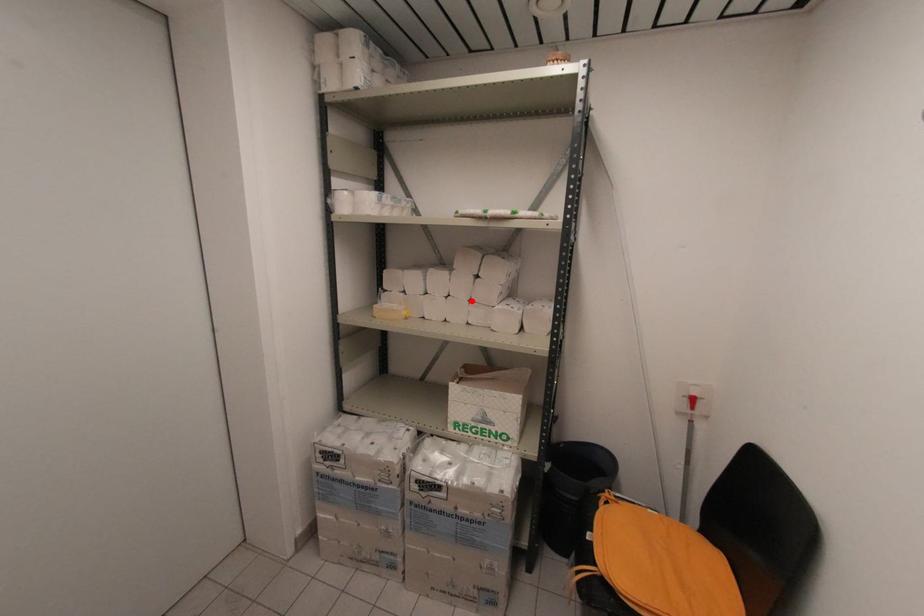
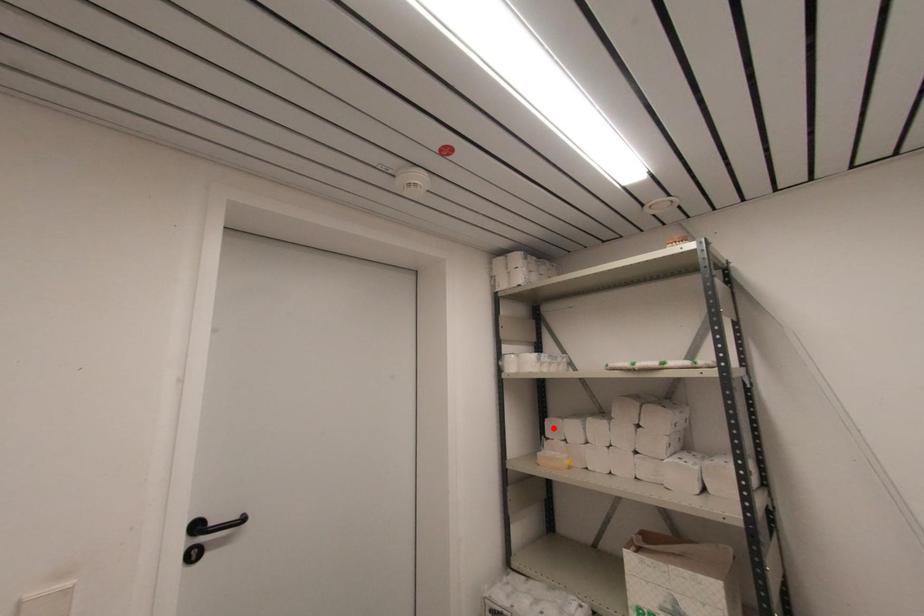
I am providing you with two images of the same scene from different viewpoints. A red point is marked on the first image and another point is marked on the second image. Do the highlighted points in image1 and image2 indicate the same real-world spot?

No